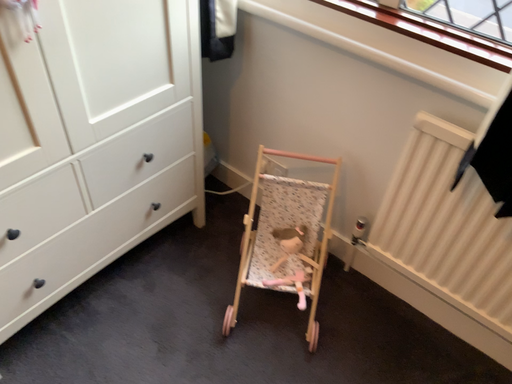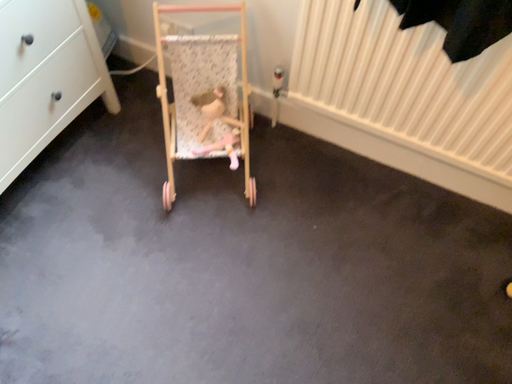
Question: How did the camera likely rotate when shooting the video?

Choices:
 (A) rotated upward
 (B) rotated downward

Answer: (B)